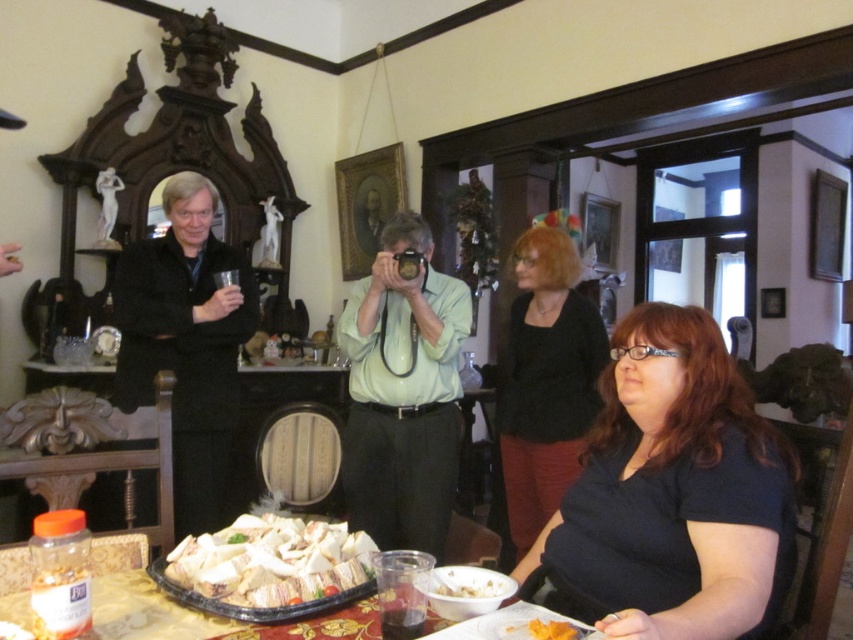
Question: Which point is closer to the camera?

Choices:
 (A) (123, 253)
 (B) (90, 636)
 (C) (495, 586)

Answer: (B)

Question: Which point is closer to the camera?

Choices:
 (A) (180, 257)
 (B) (364, 390)
 (C) (664, 534)

Answer: (C)

Question: Can you confirm if translucent plastic tray at lower center is smaller than white creamy bowl at lower center?

Choices:
 (A) yes
 (B) no

Answer: (B)

Question: Observing the image, what is the correct spatial positioning of white crumbly food at center in reference to translucent plastic tray at lower center?

Choices:
 (A) right
 (B) left

Answer: (A)

Question: In this image, where is green matte shirt at center located relative to translucent plastic tray at lower center?

Choices:
 (A) left
 (B) right

Answer: (B)

Question: Which object appears closest to the camera in this image?

Choices:
 (A) black matte suit at left
 (B) white creamy bowl at lower center

Answer: (B)